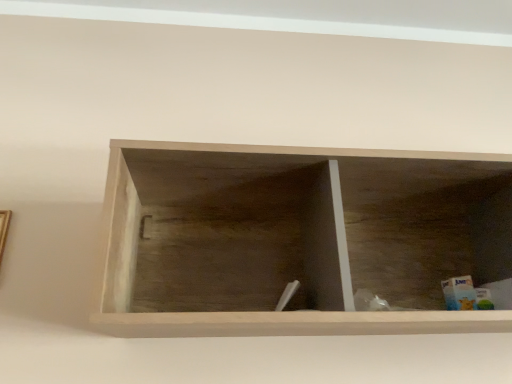
Identify the location of wooden shelf at center. (297, 238).

This screenshot has width=512, height=384. Describe the element at coordinates (297, 238) in the screenshot. I see `wooden shelf at center` at that location.

Find the location of a particular element. This screenshot has width=512, height=384. wooden shelf at center is located at coordinates (297, 238).